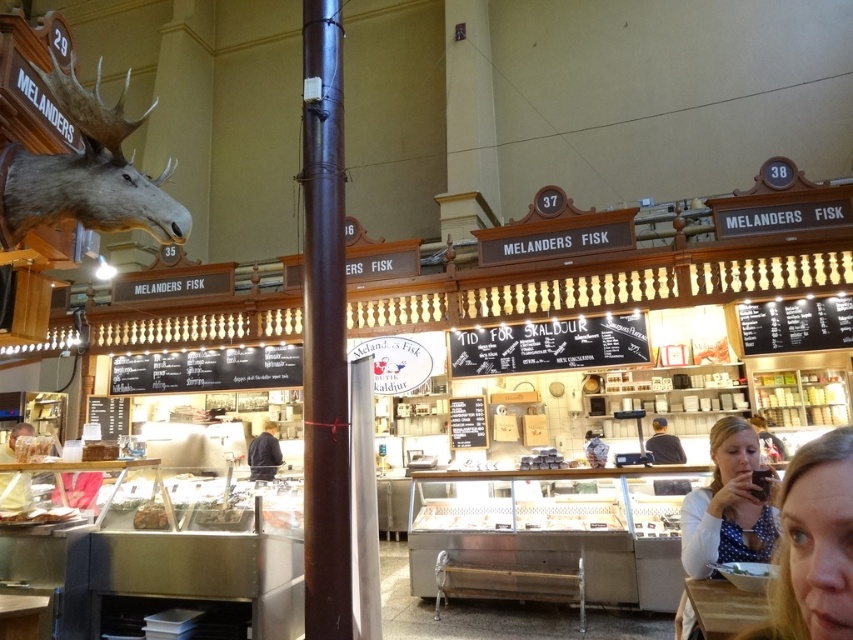
Question: Is the position of matte brown wooden tray at lower left more distant than that of dark blue shirt at center?

Choices:
 (A) no
 (B) yes

Answer: (A)

Question: Which point is closer to the camera taking this photo?

Choices:
 (A) (590, 458)
 (B) (27, 474)

Answer: (B)

Question: Which object is closer to the camera taking this photo?

Choices:
 (A) white dotted shirt at lower right
 (B) dark blue shirt at center
 (C) shiny silver tray at center

Answer: (A)

Question: Is dark brown leather jacket at center behind shiny silver tray at center?

Choices:
 (A) no
 (B) yes

Answer: (B)

Question: Can you confirm if polka dot blouse at lower right is smaller than matte brown wooden tray at lower left?

Choices:
 (A) no
 (B) yes

Answer: (A)

Question: Which object is closer to the camera taking this photo?

Choices:
 (A) dark brown leather jacket at center
 (B) brown polished wood pole at center
 (C) matte brown wooden tray at lower left

Answer: (B)